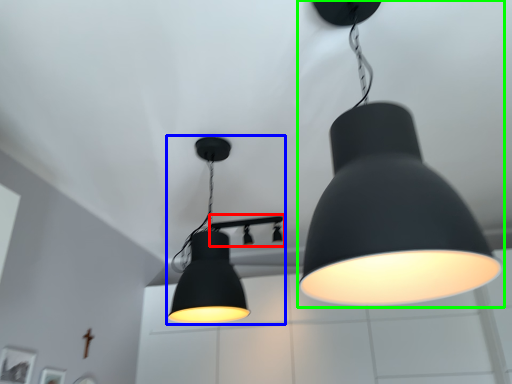
Question: Considering the real-world distances, which object is farthest from lamp (highlighted by a red box)? lamp (highlighted by a blue box) or lamp (highlighted by a green box)?

Choices:
 (A) lamp
 (B) lamp

Answer: (B)